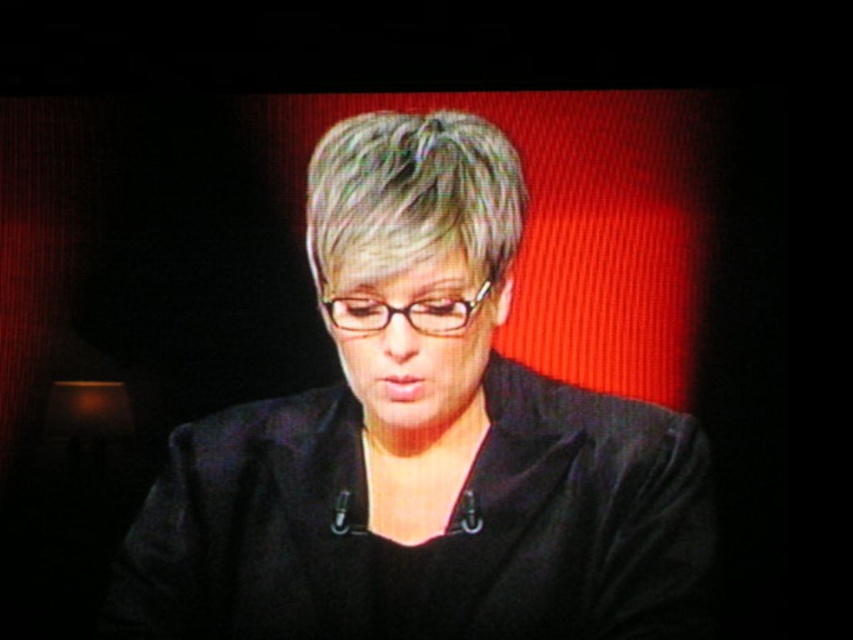
Who is higher up, gray matte hair at center or black plastic glasses at center?

gray matte hair at center is higher up.

Locate an element on the screen. The height and width of the screenshot is (640, 853). gray matte hair at center is located at coordinates (410, 196).

Between black matte jacket at center and black plastic glasses at center, which one is positioned higher?

black plastic glasses at center is above.

Can you confirm if black matte jacket at center is taller than black plastic glasses at center?

Yes, black matte jacket at center is taller than black plastic glasses at center.

You are a GUI agent. You are given a task and a screenshot of the screen. Output one action in this format:
    pyautogui.click(x=<x>, y=<y>)
    Task: Click on the black matte jacket at center
    This screenshot has height=640, width=853.
    Given the screenshot: What is the action you would take?
    pyautogui.click(x=421, y=449)

Who is more distant from viewer, (352, 563) or (358, 220)?

Positioned behind is point (352, 563).

Locate an element on the screen. black matte jacket at center is located at coordinates (421, 449).